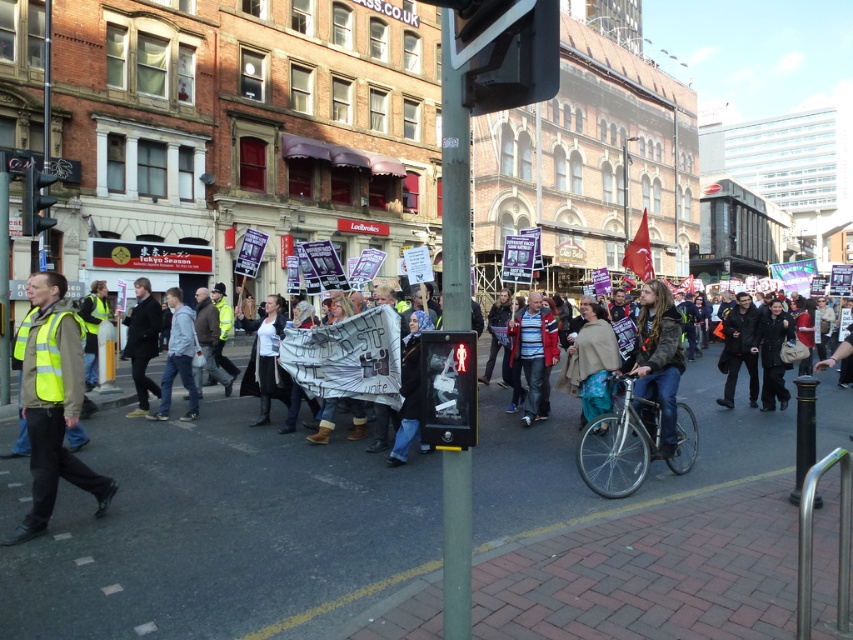
Question: Does striped cotton shirt at center have a smaller size compared to dark gray jacket at center?

Choices:
 (A) no
 (B) yes

Answer: (A)

Question: Considering the relative positions of denim jacket at center and black leather jacket at center in the image provided, where is denim jacket at center located with respect to black leather jacket at center?

Choices:
 (A) below
 (B) above

Answer: (A)

Question: Which point is farther from the camera taking this photo?

Choices:
 (A) (218, 614)
 (B) (42, 467)
 (C) (734, 320)

Answer: (C)

Question: Which is nearer to the denim jacket at center?

Choices:
 (A) striped cotton shirt at center
 (B) dark gray jacket at center
 (C) light gray fabric jacket at center

Answer: (A)

Question: Is brick pavement at lower center further to the viewer compared to beige woolen cape at center?

Choices:
 (A) no
 (B) yes

Answer: (A)

Question: Which is farther from the denim jacket at center?

Choices:
 (A) beige woolen cape at center
 (B) dark gray jacket at center
 (C) black leather jacket at center

Answer: (B)